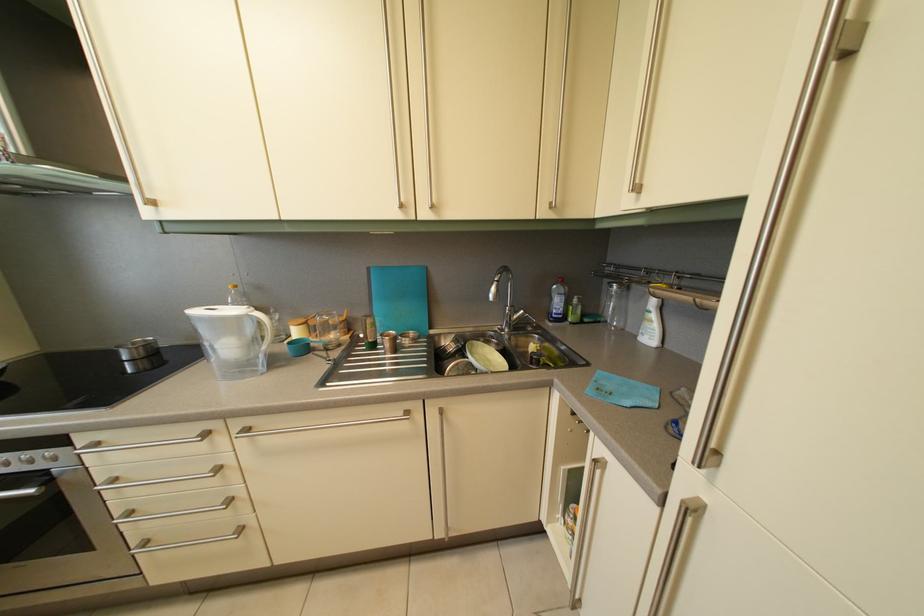
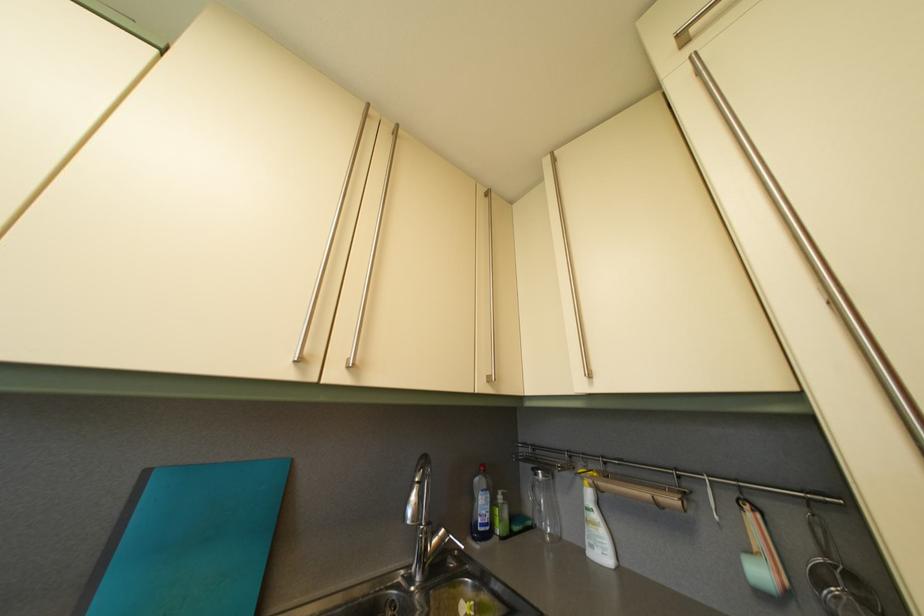
The point at (554, 204) is marked in the first image. Where is the corresponding point in the second image?

(492, 376)